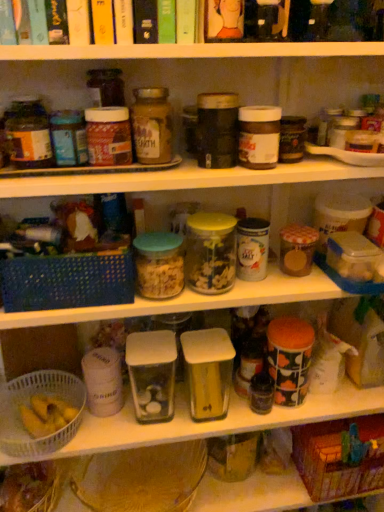
Question: From a real-world perspective, is matte glass jar at center, arranged as the 2th bottle when viewed from the left, over translucent plastic bag at lower left?

Choices:
 (A) no
 (B) yes

Answer: (B)

Question: Is matte glass jar at center, marked as the first bottle in a right-to-left arrangement, smaller than translucent plastic bag at lower left?

Choices:
 (A) yes
 (B) no

Answer: (A)

Question: Considering the relative positions of matte glass jar at center, marked as the first bottle in a right-to-left arrangement, and translucent plastic bag at lower left in the image provided, is matte glass jar at center, marked as the first bottle in a right-to-left arrangement, in front of translucent plastic bag at lower left?

Choices:
 (A) yes
 (B) no

Answer: (A)

Question: Does matte glass jar at center, marked as the first bottle in a right-to-left arrangement, appear on the right side of translucent plastic bag at lower left?

Choices:
 (A) no
 (B) yes

Answer: (B)

Question: Are matte glass jar at center, marked as the first bottle in a right-to-left arrangement, and translucent plastic bag at lower left far apart?

Choices:
 (A) yes
 (B) no

Answer: (B)

Question: Which is correct: translucent plastic bag at lower left is inside translucent glass jar at center, or outside of it?

Choices:
 (A) outside
 (B) inside

Answer: (A)

Question: Is point (21, 465) positioned closer to the camera than point (196, 248)?

Choices:
 (A) farther
 (B) closer

Answer: (A)

Question: Relative to translucent glass jar at center, is translucent plastic bag at lower left in front or behind?

Choices:
 (A) front
 (B) behind

Answer: (B)

Question: From the image's perspective, is translucent plastic bag at lower left located above or below translucent glass jar at center?

Choices:
 (A) below
 (B) above

Answer: (A)

Question: Does point (160, 161) appear closer or farther from the camera than point (49, 475)?

Choices:
 (A) farther
 (B) closer

Answer: (B)

Question: From a real-world perspective, is matte glass jar at center, marked as the first bottle in a right-to-left arrangement, positioned above or below translucent plastic bag at lower left?

Choices:
 (A) above
 (B) below

Answer: (A)

Question: In terms of height, does matte glass jar at center, marked as the first bottle in a right-to-left arrangement, look taller or shorter compared to translucent plastic bag at lower left?

Choices:
 (A) short
 (B) tall

Answer: (B)

Question: In terms of size, does matte glass jar at center, marked as the first bottle in a right-to-left arrangement, appear bigger or smaller than translucent plastic bag at lower left?

Choices:
 (A) big
 (B) small

Answer: (B)

Question: From the image's perspective, is blue woven basket at left, which ranks as the 2th basket in left-to-right order, located above or below matte brown jar at upper left, the first bottle from the left?

Choices:
 (A) above
 (B) below

Answer: (B)

Question: Looking at their shapes, would you say blue woven basket at left, which ranks as the 3th basket in bottom-to-top order, is wider or thinner than matte brown jar at upper left, which ranks as the second bottle in right-to-left order?

Choices:
 (A) thin
 (B) wide

Answer: (B)